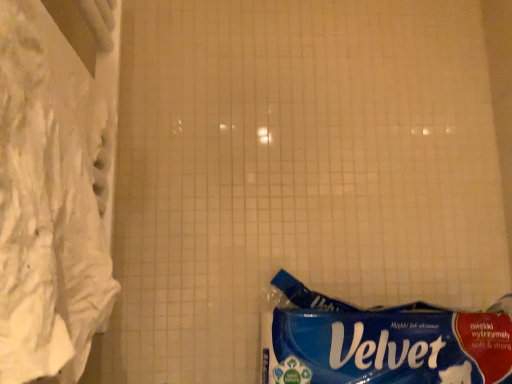
Question: From the image's perspective, is blue paper towel at lower right below white fabric curtain at left?

Choices:
 (A) yes
 (B) no

Answer: (A)

Question: Could white fabric curtain at left be considered to be inside blue paper towel at lower right?

Choices:
 (A) yes
 (B) no

Answer: (B)

Question: Is blue paper towel at lower right facing away from white fabric curtain at left?

Choices:
 (A) yes
 (B) no

Answer: (B)

Question: Does blue paper towel at lower right appear on the right side of white fabric curtain at left?

Choices:
 (A) no
 (B) yes

Answer: (B)

Question: Does blue paper towel at lower right have a lesser width compared to white fabric curtain at left?

Choices:
 (A) no
 (B) yes

Answer: (A)

Question: Is blue paper towel at lower right facing towards white fabric curtain at left?

Choices:
 (A) no
 (B) yes

Answer: (A)

Question: Is blue paper towel at lower right surrounded by white fabric curtain at left?

Choices:
 (A) no
 (B) yes

Answer: (A)

Question: Is white fabric curtain at left with blue paper towel at lower right?

Choices:
 (A) yes
 (B) no

Answer: (B)

Question: Can you confirm if white fabric curtain at left is smaller than blue paper towel at lower right?

Choices:
 (A) yes
 (B) no

Answer: (A)

Question: Is white fabric curtain at left positioned beyond the bounds of blue paper towel at lower right?

Choices:
 (A) yes
 (B) no

Answer: (A)

Question: Does white fabric curtain at left have a lesser width compared to blue paper towel at lower right?

Choices:
 (A) yes
 (B) no

Answer: (A)

Question: Does white fabric curtain at left lie in front of blue paper towel at lower right?

Choices:
 (A) yes
 (B) no

Answer: (A)

Question: Considering the positions of blue paper towel at lower right and white fabric curtain at left in the image, is blue paper towel at lower right taller or shorter than white fabric curtain at left?

Choices:
 (A) tall
 (B) short

Answer: (B)